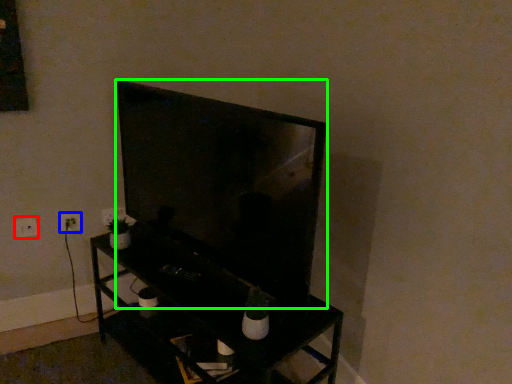
Question: Considering the real-world distances, which object is farthest from electric outlet (highlighted by a red box)? electric outlet (highlighted by a blue box) or television (highlighted by a green box)?

Choices:
 (A) electric outlet
 (B) television

Answer: (B)